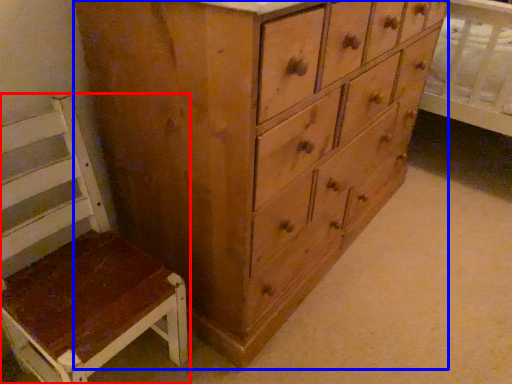
Question: Among these objects, which one is nearest to the camera, furniture (highlighted by a red box) or chest of drawers (highlighted by a blue box)?

Choices:
 (A) furniture
 (B) chest of drawers

Answer: (A)